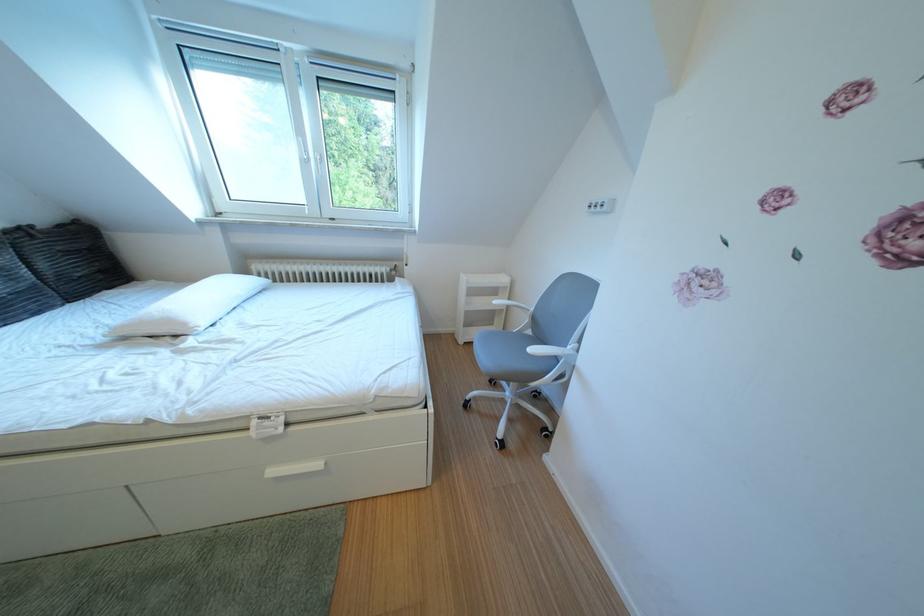
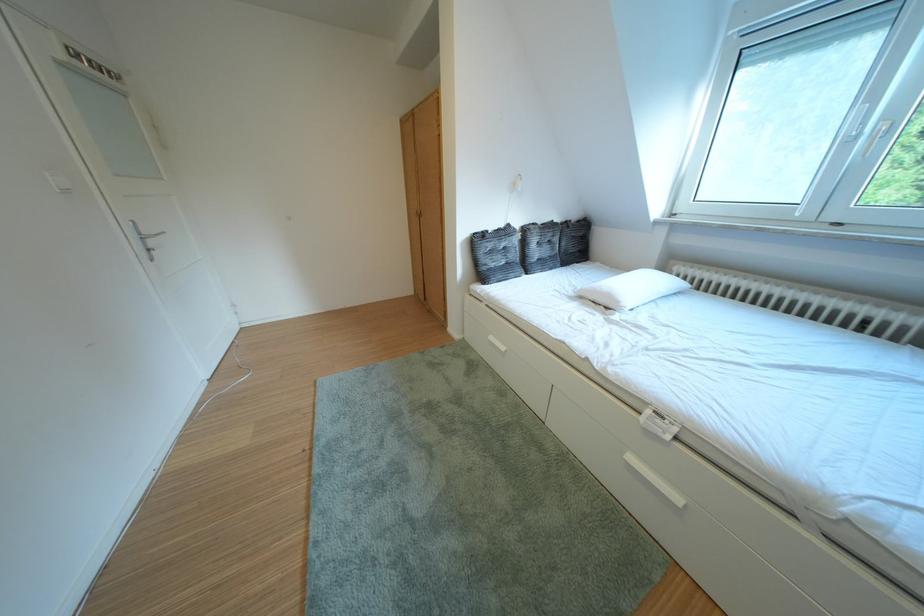
Question: How did the camera likely rotate?

Choices:
 (A) Left
 (B) Right
 (C) Up
 (D) Down

Answer: (A)